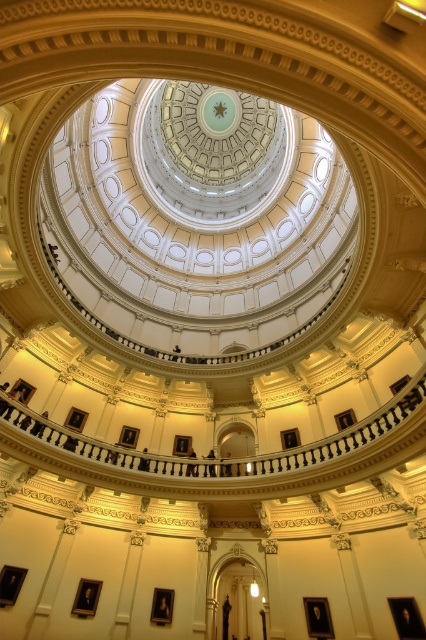
Question: Does white marble dome at center appear over white marble balustrade at center?

Choices:
 (A) yes
 (B) no

Answer: (A)

Question: Considering the relative positions of white marble dome at center and white marble balustrade at center in the image provided, where is white marble dome at center located with respect to white marble balustrade at center?

Choices:
 (A) above
 (B) below

Answer: (A)

Question: Which of the following is the farthest from the observer?

Choices:
 (A) (298, 209)
 (B) (5, 412)

Answer: (A)

Question: Can you confirm if white marble dome at center is wider than white marble balustrade at center?

Choices:
 (A) no
 (B) yes

Answer: (B)